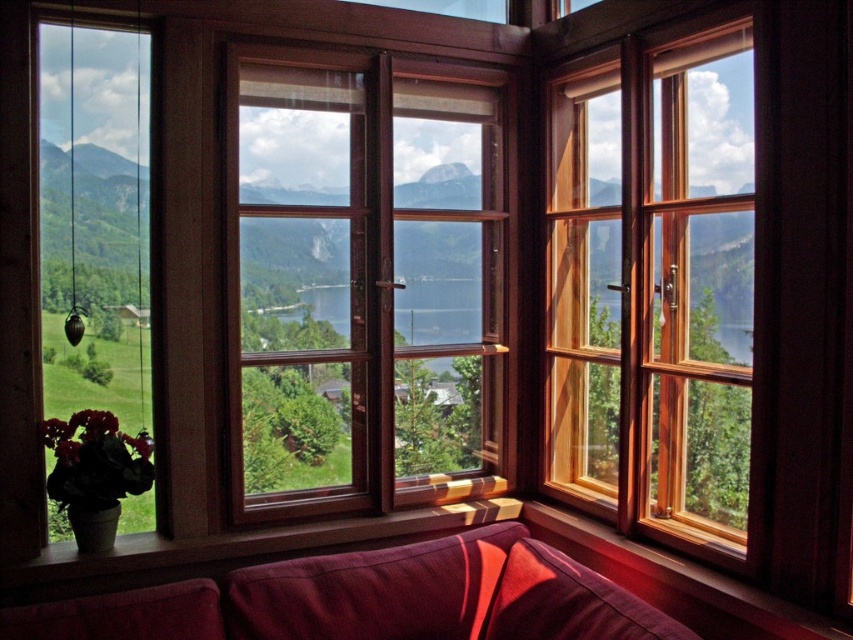
Question: Among these objects, which one is nearest to the camera?

Choices:
 (A) velvet burgundy couch at lower center
 (B) wooden window at center

Answer: (A)

Question: Is wooden window at center above velvet burgundy couch at lower center?

Choices:
 (A) yes
 (B) no

Answer: (A)

Question: Estimate the real-world distances between objects in this image. Which object is farther from the velvet burgundy couch at lower center?

Choices:
 (A) wooden window at upper right
 (B) wooden window at center

Answer: (A)

Question: Can you confirm if wooden window at center is thinner than velvet burgundy couch at lower center?

Choices:
 (A) no
 (B) yes

Answer: (B)

Question: Which point is farther to the camera?

Choices:
 (A) (751, 262)
 (B) (491, 545)

Answer: (B)

Question: Is wooden window at center to the left of wooden window at upper right from the viewer's perspective?

Choices:
 (A) yes
 (B) no

Answer: (A)